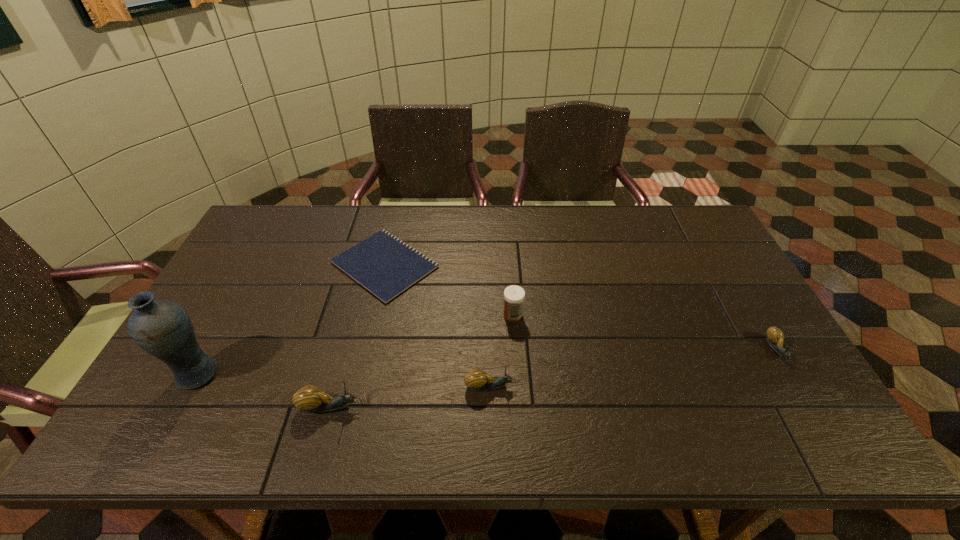
This screenshot has width=960, height=540. I want to click on object at the near left corner, so click(162, 328).

The image size is (960, 540). Find the location of `vacant point at the far edge`. vacant point at the far edge is located at coordinates (412, 218).

Identify the location of vacant area at the left edge of the desktop. (233, 357).

In the image, there is a desktop. Identify the location of vacant space at the right edge. (760, 329).

In the image, there is a desktop. Identify the location of blank space at the near right corner. The width and height of the screenshot is (960, 540). (780, 398).

Locate an element on the screen. The height and width of the screenshot is (540, 960). free spot between the nearest escargot and the shortest object is located at coordinates (357, 335).

The image size is (960, 540). I want to click on free space between the farthest object and the rightmost object, so click(581, 307).

The image size is (960, 540). Find the location of `free point between the nearest object and the shortest object`. free point between the nearest object and the shortest object is located at coordinates (357, 335).

At what (x,y) coordinates should I click in order to perform the action: click on free point between the medicine and the leftmost object. Please return your answer as a coordinate pair (x, y). Image resolution: width=960 pixels, height=540 pixels. Looking at the image, I should click on (355, 345).

This screenshot has width=960, height=540. What are the coordinates of `blank region between the rightmost escargot and the notepad` in the screenshot? It's located at (581, 307).